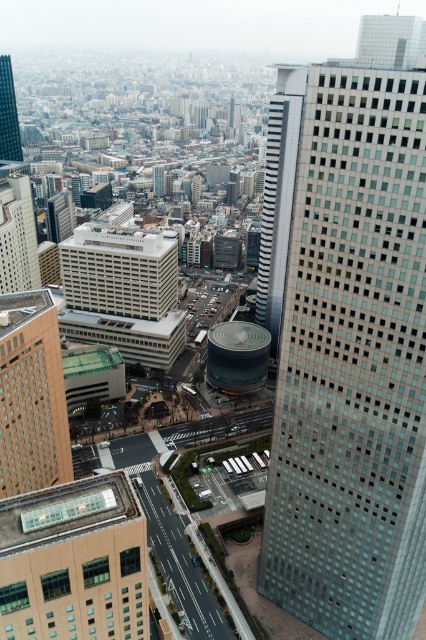
You are standing at a high vantage point in the city, looking down at the urban landscape. There is a specific point marked at coordinates point (331,550). If you were to drop a small pebble from your current position, would it land near that point? Please explain your reasoning based on the distance provided.

The distance between the viewer and point (331,550) is 156.29 meters. Since the pebble would fall straight down due to gravity, it would land directly below the point where you are standing, not necessarily near the marked point unless you are directly above it. The horizontal distance of 156.29 meters indicates the pebble would land far away from the marked point unless there is a specific alignment.

You are a drone operator trying to navigate a delivery drone through the city. Your current position is directly above the matte glass skyscraper at upper left. The delivery destination is the glassy steel skyscraper at right. Which direction should you fly to reach the destination?

The glassy steel skyscraper at right is to the right of the matte glass skyscraper at upper left, so you should fly to the right to reach the destination.

You are a drone operator trying to capture aerial shots of the city. You need to fly your drone from the glassy steel skyscraper at right to the matte glass skyscraper at upper left. Which direction should you fly the drone to move away from the viewer?

To move away from the viewer, you should fly the drone towards the matte glass skyscraper at upper left since it is farther away compared to the glassy steel skyscraper at right.